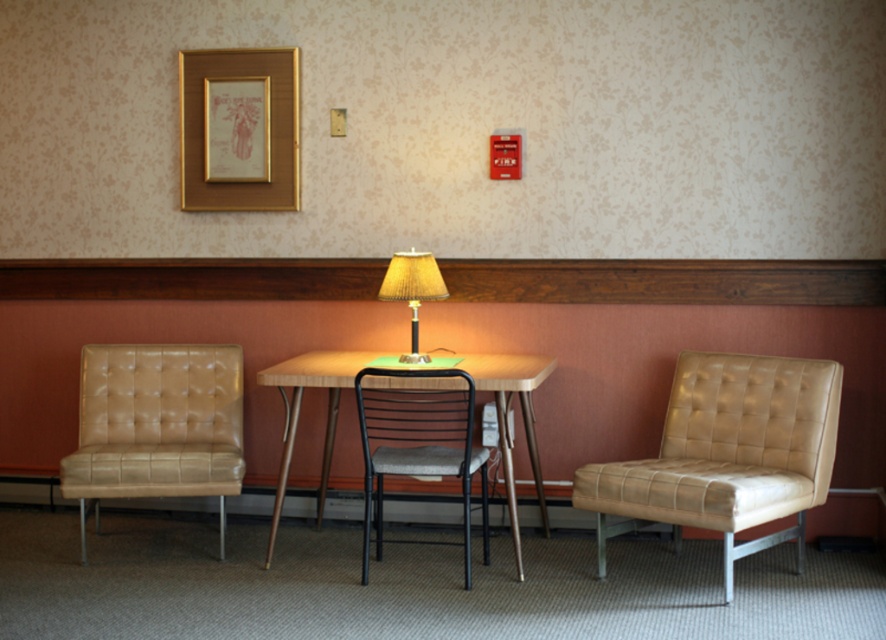
You are arranging a centerpiece on the wooden table at center and need to ensure it fits within the table. The lamp with the matte beige lampshade at center is already placed there. Can the centerpiece be wider than the lampshade?

The wooden table at center is wider than the matte beige lampshade at center, so yes, the centerpiece can be wider than the lampshade as it will still fit on the table.

You are standing in the room and want to place a small vase on the wooden table at center. However, there is a matte beige lampshade at center in the way. Which object should you move first to access the table?

The matte beige lampshade at center is further away from you than the wooden table at center. To access the wooden table at center, you should move the matte beige lampshade at center first.